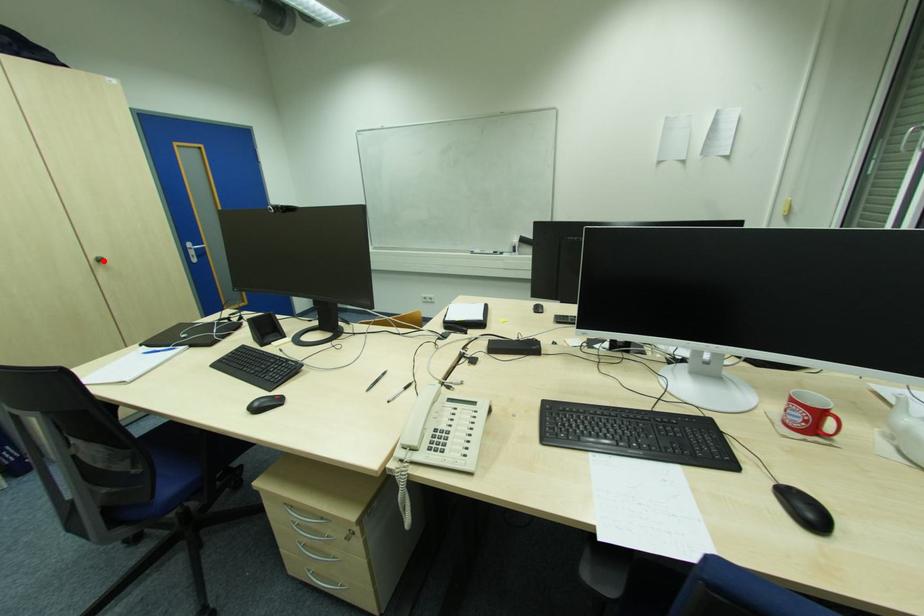
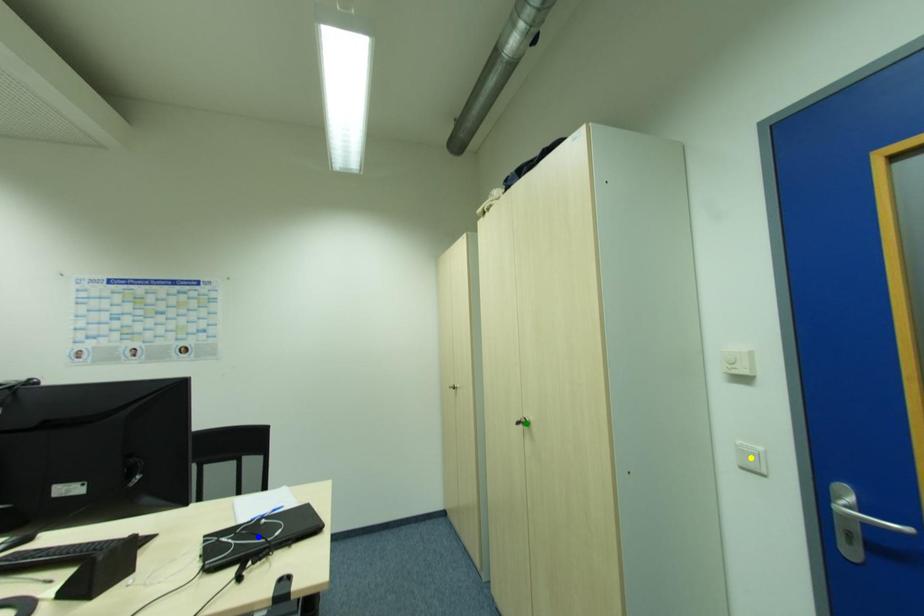
Question: I am providing you with two images of the same scene from different viewpoints. A red point is marked on the first image. You are given multiple points on the second image. In image 2, which mark is for the same physical point as the one in image 1?

Choices:
 (A) green point
 (B) yellow point
 (C) blue point

Answer: (A)